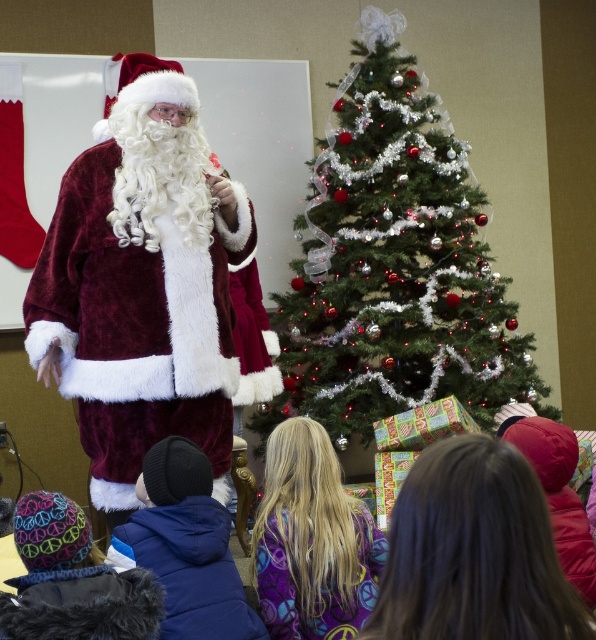
Which is more to the left, shiny silver christmas tree at center or velvet maroon santa at left?

velvet maroon santa at left

Is point (311, 388) more distant than point (101, 486)?

Yes.

Find the location of `shiny silver christmas tree at center`. shiny silver christmas tree at center is located at coordinates (393, 264).

Does shiny silver christmas tree at center appear under purple fleece sweatshirt at lower center?

No, shiny silver christmas tree at center is not below purple fleece sweatshirt at lower center.

Can you confirm if shiny silver christmas tree at center is wider than purple fleece sweatshirt at lower center?

Correct, the width of shiny silver christmas tree at center exceeds that of purple fleece sweatshirt at lower center.

Who is more distant from viewer, (367, 4) or (271, 541)?

The point (367, 4) is behind.

I want to click on shiny silver christmas tree at center, so click(x=393, y=264).

Between velvet maroon santa at left and purple fleece sweatshirt at lower center, which one has more height?

Standing taller between the two is velvet maroon santa at left.

Describe the element at coordinates (141, 285) in the screenshot. The width and height of the screenshot is (596, 640). I see `velvet maroon santa at left` at that location.

Image resolution: width=596 pixels, height=640 pixels. I want to click on velvet maroon santa at left, so click(x=141, y=285).